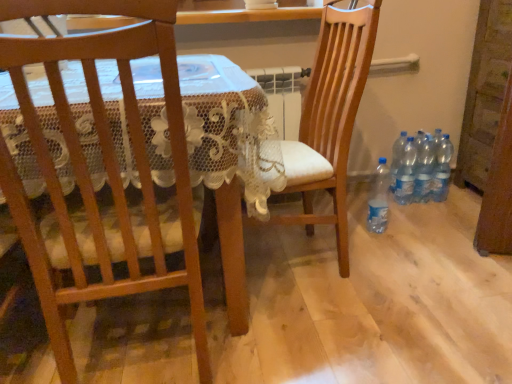
Where is `vacant space underneath wooden chair at center, which is counted as the 1th chair, starting from the right (from a real-world perspective)`? vacant space underneath wooden chair at center, which is counted as the 1th chair, starting from the right (from a real-world perspective) is located at coordinates (290, 259).